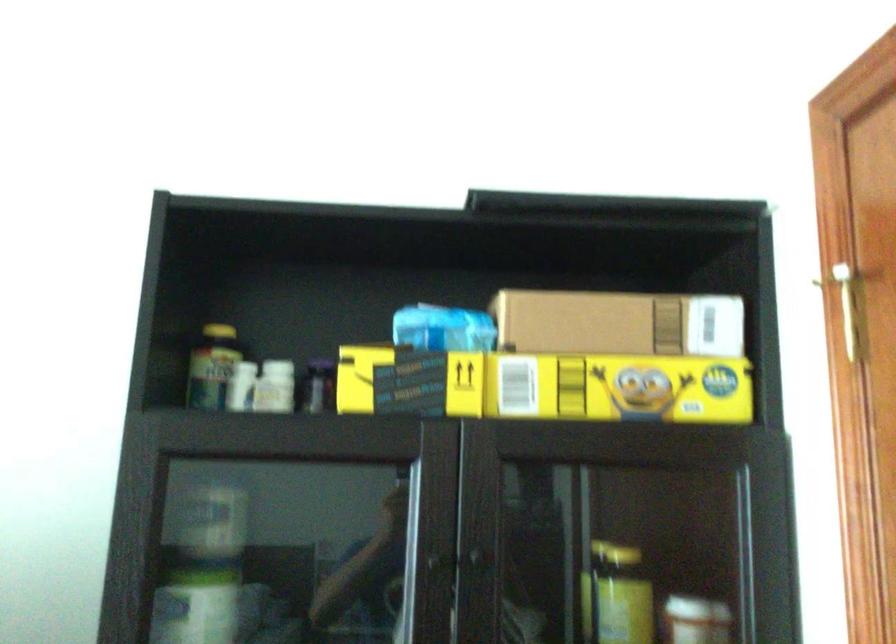
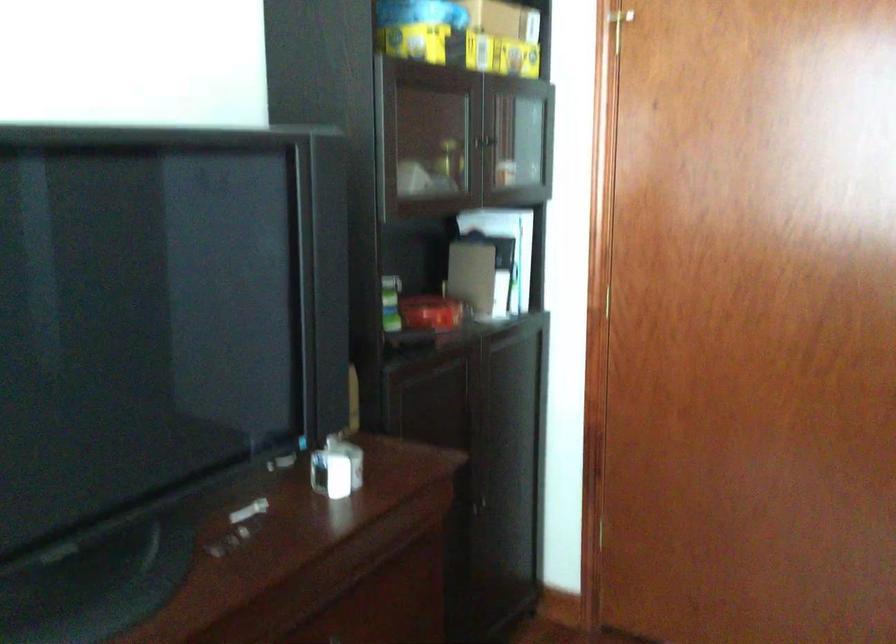
The point at [486,569] is marked in the first image. Where is the corresponding point in the second image?

(492, 140)